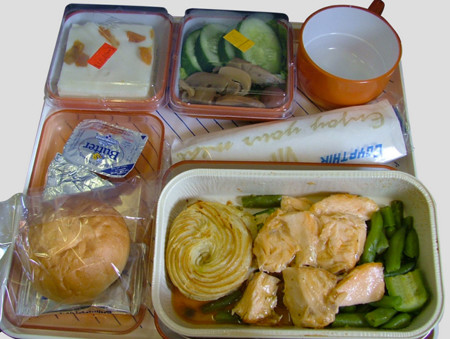
Identify the location of cup. click(360, 81).